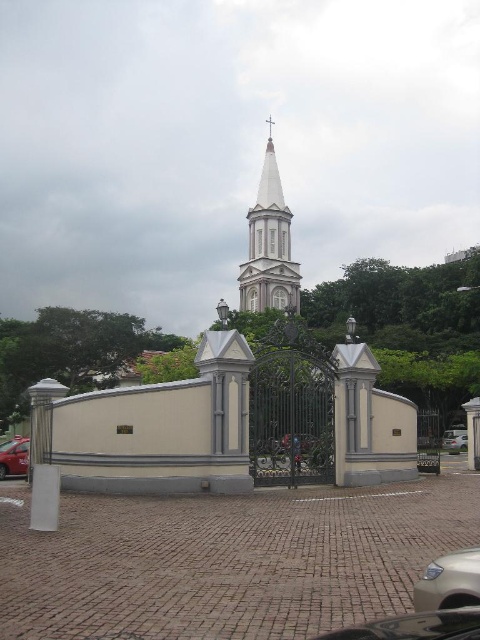
Question: Which object is positioned farthest from the silver metallic car at center?

Choices:
 (A) metallic red taxi at lower left
 (B) white glossy steeple at center

Answer: (B)

Question: Does white glossy steeple at center lie in front of metallic red taxi at lower left?

Choices:
 (A) no
 (B) yes

Answer: (A)

Question: Is satin gold car at lower right wider than silver metallic car at center?

Choices:
 (A) yes
 (B) no

Answer: (A)

Question: Which of the following is the farthest from the observer?

Choices:
 (A) metallic red taxi at lower left
 (B) white glossy steeple at center
 (C) silver metallic car at center
 (D) satin gold car at lower right

Answer: (B)

Question: Among these points, which one is nearest to the camera?

Choices:
 (A) (24, 472)
 (B) (277, 276)
 (C) (451, 440)
 (D) (447, 561)

Answer: (D)

Question: Can you confirm if metallic red taxi at lower left is bigger than silver metallic car at center?

Choices:
 (A) yes
 (B) no

Answer: (A)